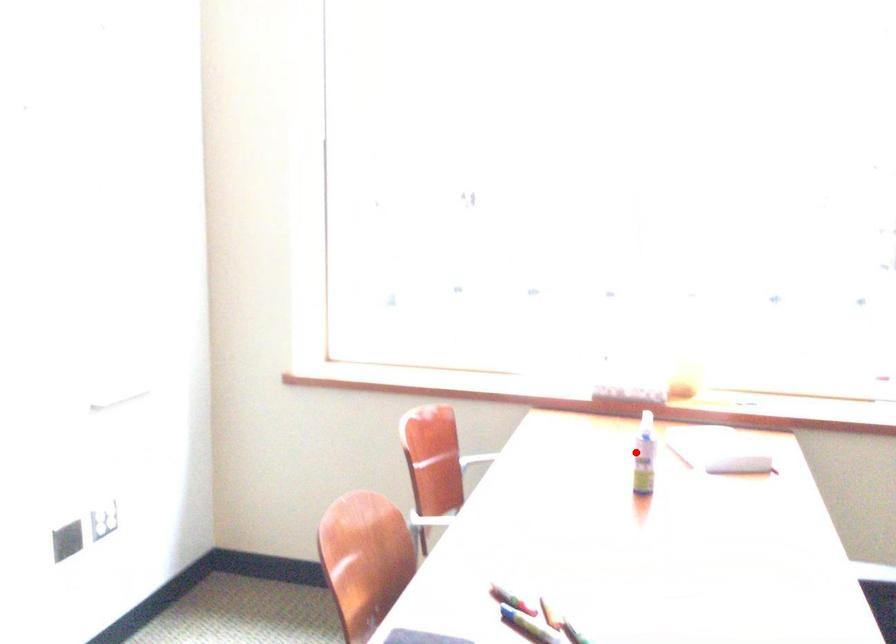
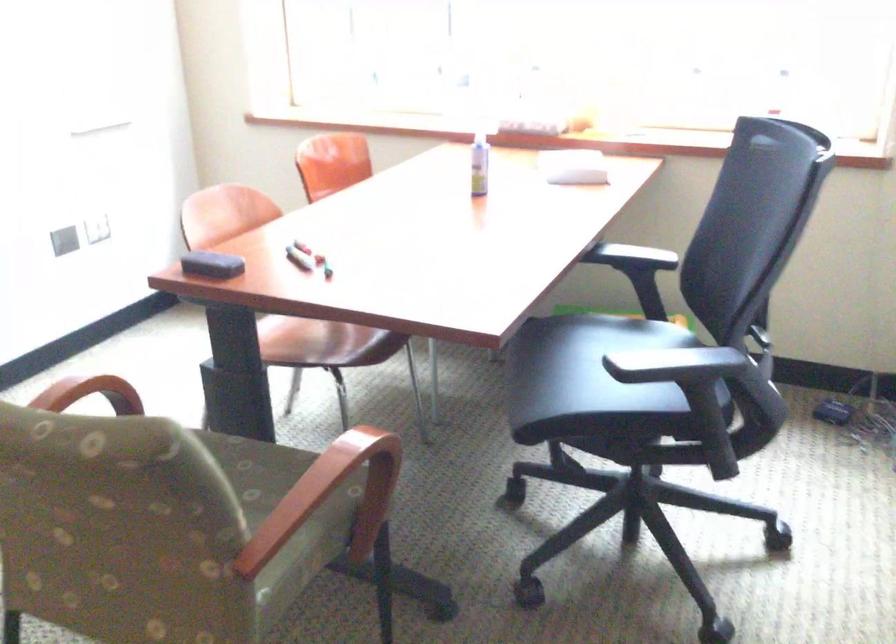
The point at the highlighted location is marked in the first image. Where is the corresponding point in the second image?

(478, 164)